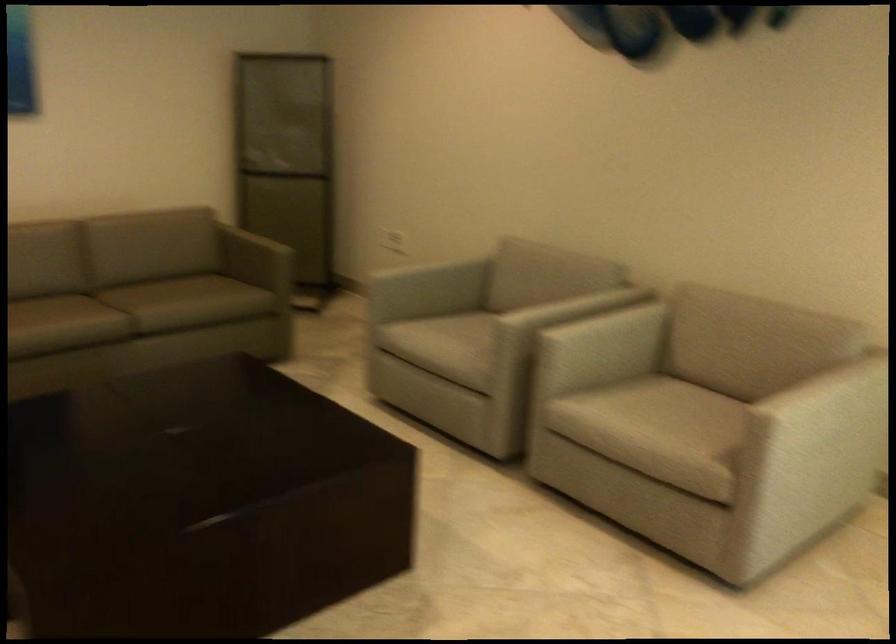
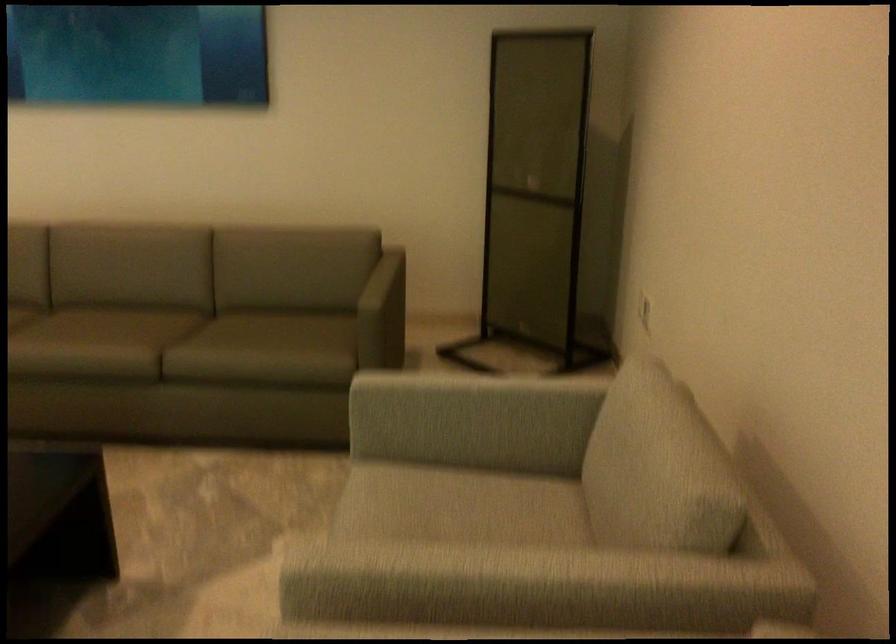
Find the pixel in the second image that matches point (290, 167) in the first image.

(536, 194)